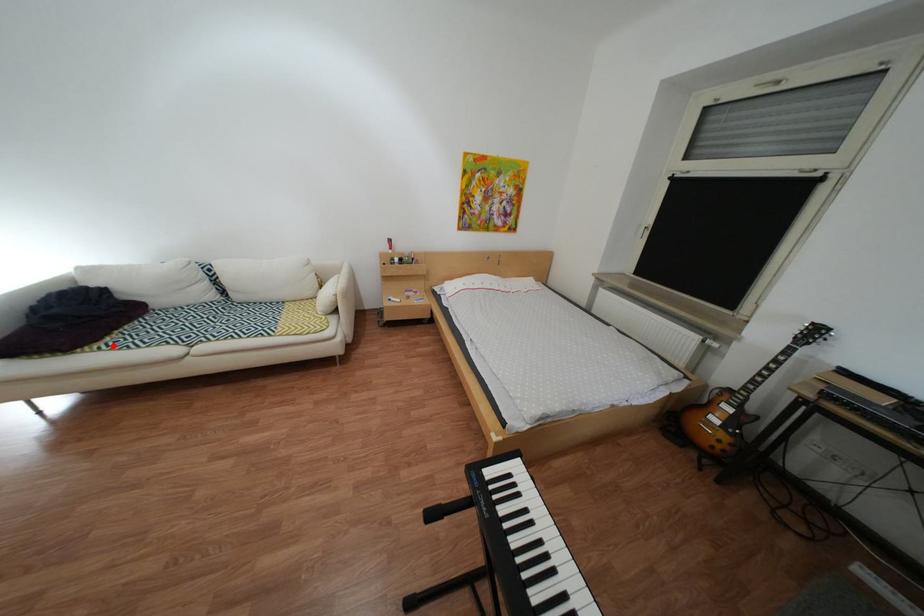
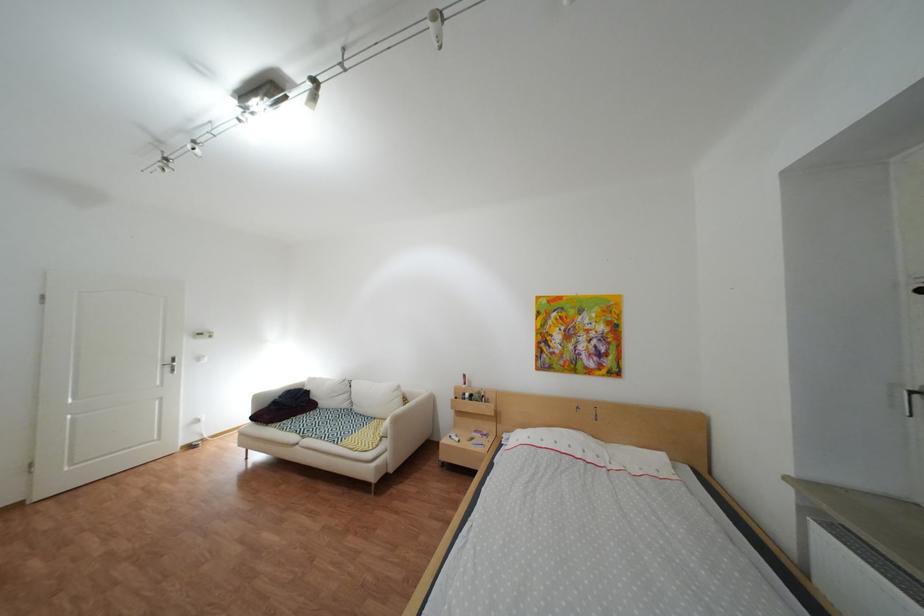
Question: I am providing you with two images of the same scene from different viewpoints. Image1 has a red point marked. In image2, the corresponding 3D location appears at what relative position? Reply with the corresponding letter.

Choices:
 (A) Closer
 (B) Farther

Answer: (B)